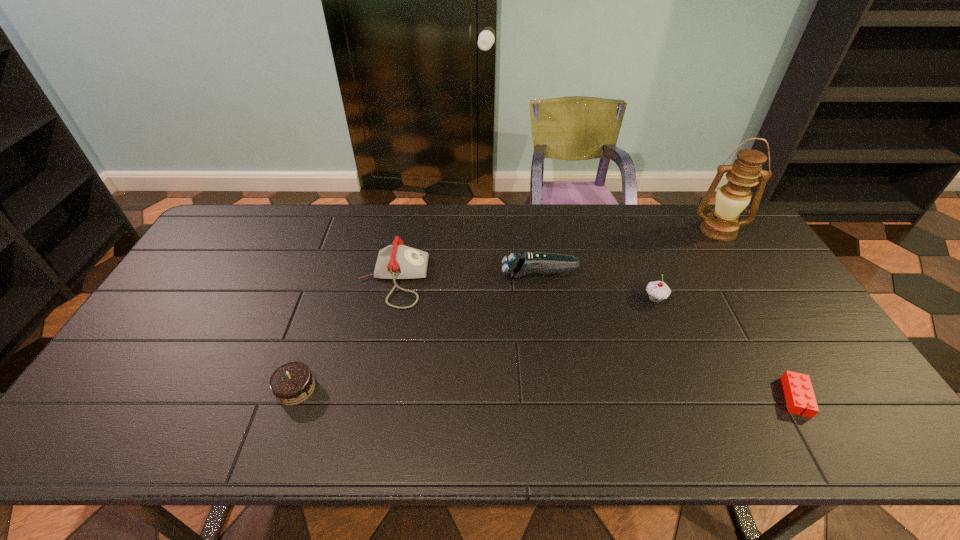
You are a GUI agent. You are given a task and a screenshot of the screen. Output one action in this format:
    pyautogui.click(x=<x>, y=<y>)
    Task: Click on the vacant space that's between the tallest object and the cupcake
    This screenshot has height=540, width=960.
    Given the screenshot: What is the action you would take?
    pyautogui.click(x=686, y=265)

This screenshot has width=960, height=540. I want to click on empty location between the chocolate cake and the telephone, so click(344, 334).

You are a GUI agent. You are given a task and a screenshot of the screen. Output one action in this format:
    pyautogui.click(x=<x>, y=<y>)
    Task: Click on the free space between the cupcake and the leftmost object
    This screenshot has height=540, width=960.
    Given the screenshot: What is the action you would take?
    pyautogui.click(x=475, y=344)

You are a GUI agent. You are given a task and a screenshot of the screen. Output one action in this format:
    pyautogui.click(x=<x>, y=<y>)
    Task: Click on the vacant area that lies between the Lego and the telephone
    
    Given the screenshot: What is the action you would take?
    pyautogui.click(x=594, y=339)

Identify which object is the second nearest to the oil lamp. Please provide its 2D coordinates. Your answer should be formatted as a tuple, i.e. [(x, y)], where the tuple contains the x and y coordinates of a point satisfying the conditions above.

[(517, 265)]

You are a GUI agent. You are given a task and a screenshot of the screen. Output one action in this format:
    pyautogui.click(x=<x>, y=<y>)
    Task: Click on the object identified as the closest to the chocolate cake
    This screenshot has height=540, width=960.
    Given the screenshot: What is the action you would take?
    pyautogui.click(x=397, y=261)

What are the coordinates of `free location that satisfies the following two spatial constraints: 1. on the front side of the chocolate cake; 2. on the left side of the Lego` in the screenshot? It's located at (293, 397).

Identify the location of free space that satisfies the following two spatial constraints: 1. on the dial of the telephone; 2. on the back side of the shortest object. This screenshot has width=960, height=540. (369, 397).

Image resolution: width=960 pixels, height=540 pixels. Find the location of `vacant space that satisfies the following two spatial constraints: 1. on the back side of the leftmost object; 2. on the left side of the fourth object from left to right`. vacant space that satisfies the following two spatial constraints: 1. on the back side of the leftmost object; 2. on the left side of the fourth object from left to right is located at coordinates (326, 299).

Where is `vacant space that satisfies the following two spatial constraints: 1. on the back side of the chocolate cake; 2. on the left side of the fourth object from left to right`? Image resolution: width=960 pixels, height=540 pixels. vacant space that satisfies the following two spatial constraints: 1. on the back side of the chocolate cake; 2. on the left side of the fourth object from left to right is located at coordinates (326, 299).